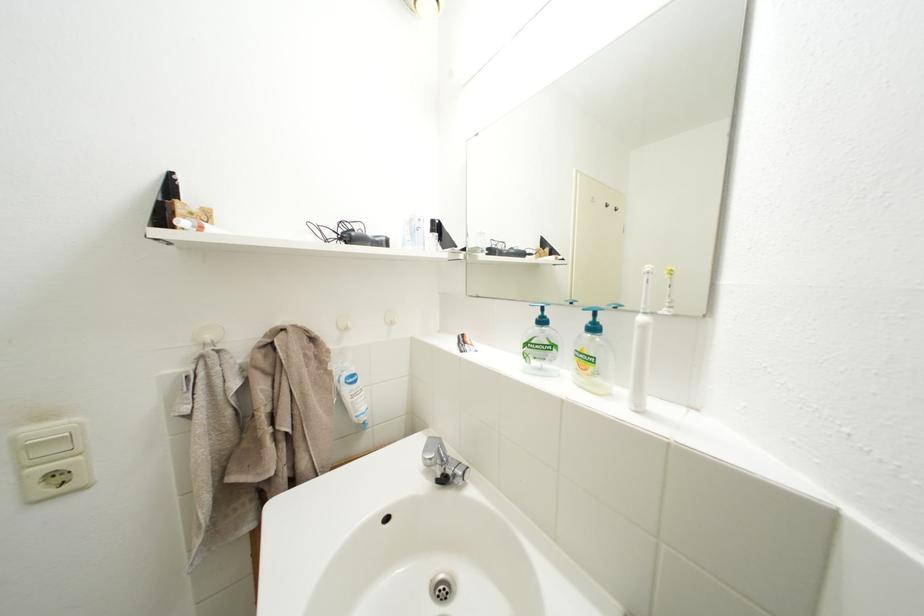
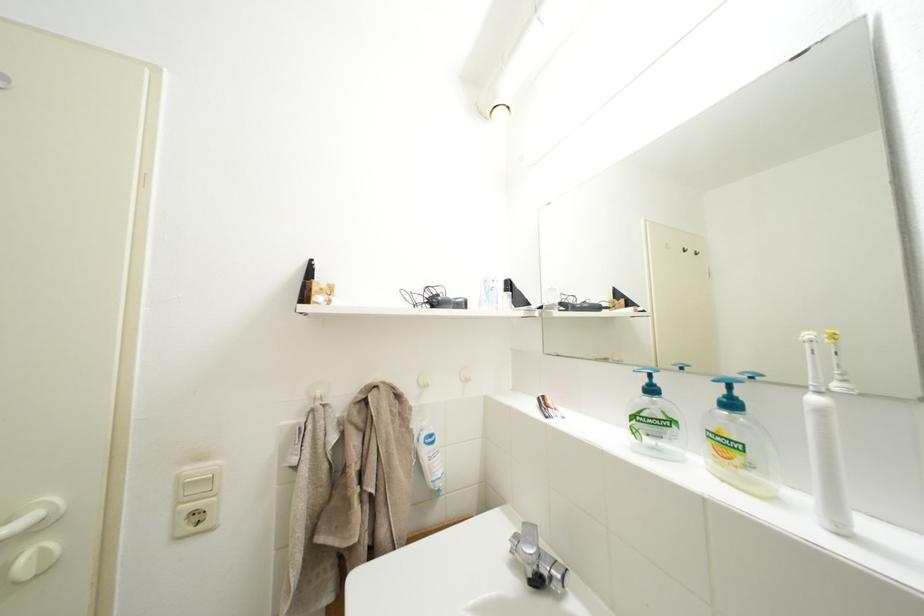
Locate, in the second image, the point that corresponds to point 41,435 in the first image.

(200, 475)